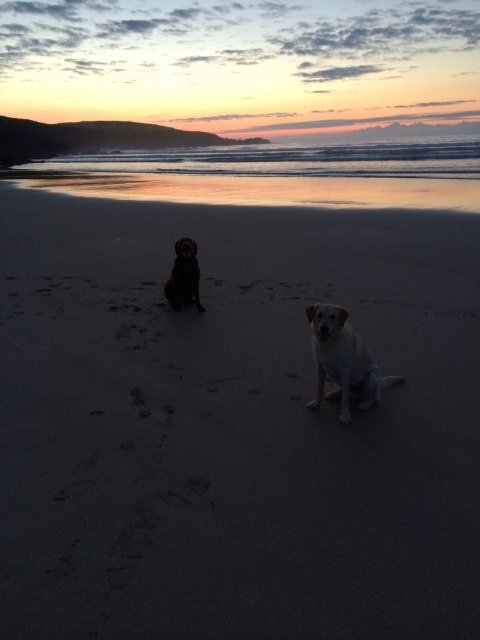
You are standing on the beach and want to place a small bucket on the sand. The bucket needs to be placed to the left of the shiny black dog at center. Is there enough space on the smooth sand at center for this?

The smooth sand at center is located to the right of the shiny black dog at center, so placing the bucket to the left of the shiny black dog at center would not be on the smooth sand at center. Therefore, there might not be enough space or the correct surface for the bucket as described.